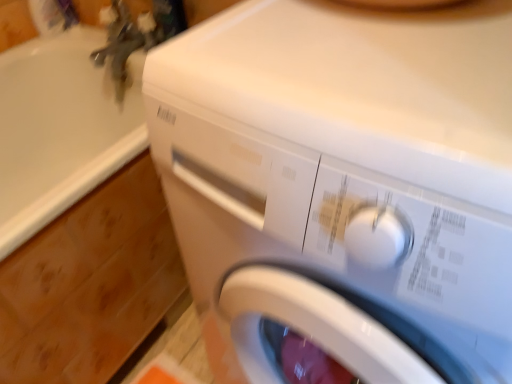
What do you see at coordinates (342, 190) in the screenshot? The image size is (512, 384). I see `white glossy washing machine at center` at bounding box center [342, 190].

Measure the distance between point (x=477, y=306) and camera.

They are 12.99 inches apart.

Image resolution: width=512 pixels, height=384 pixels. In order to click on white glossy washing machine at center in this screenshot , I will do `click(342, 190)`.

Locate an element on the screen. The image size is (512, 384). white glossy washing machine at center is located at coordinates (342, 190).